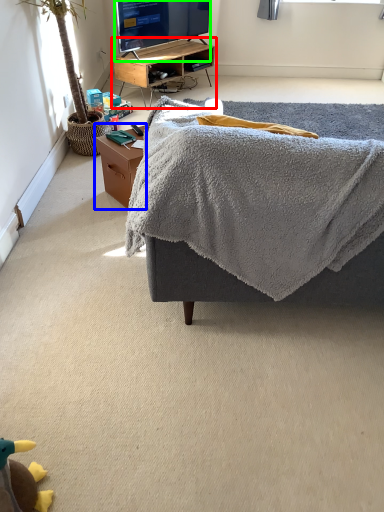
Question: Which object is positioned farthest from desk (highlighted by a red box)? Select from table (highlighted by a blue box) and television (highlighted by a green box).

Choices:
 (A) table
 (B) television

Answer: (A)